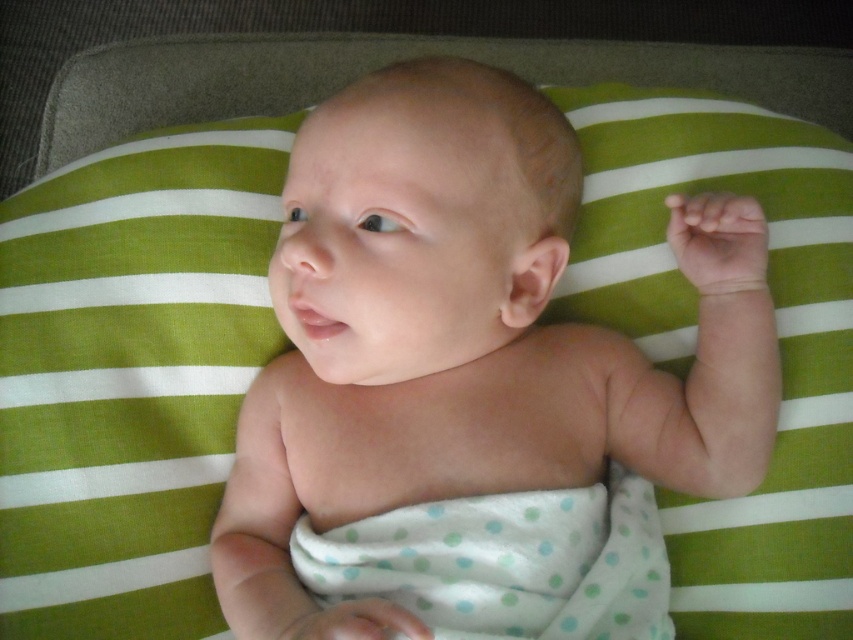
Who is more distant from viewer, (427, 339) or (444, 541)?

The point (427, 339) is more distant.

Where is `smooth skin baby at center`? The image size is (853, 640). smooth skin baby at center is located at coordinates (465, 339).

The height and width of the screenshot is (640, 853). Find the location of `smooth skin baby at center`. smooth skin baby at center is located at coordinates (465, 339).